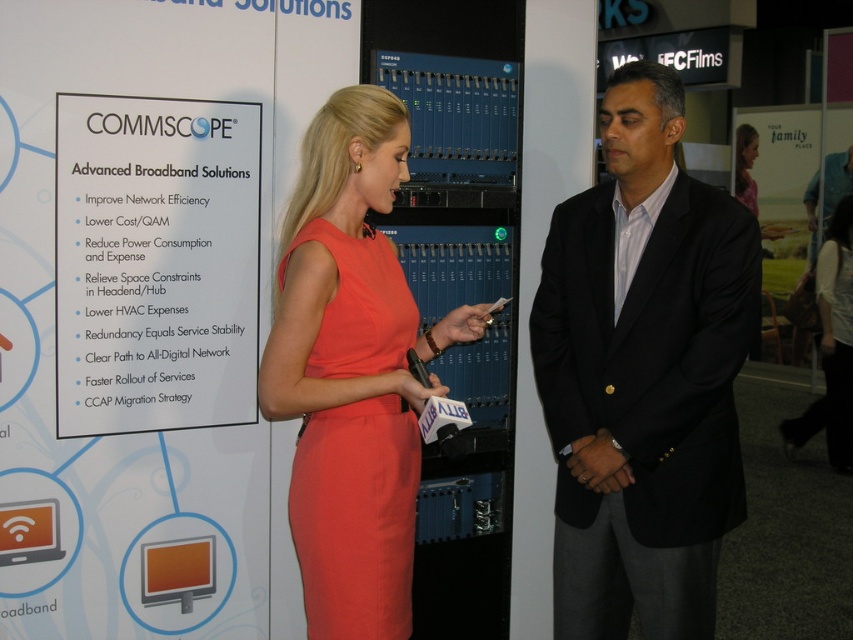
You are standing in the center of the exhibition hall and need to locate the black suit at center. According to the coordinates provided, where should you look relative to the banner?

The black suit at center is located at coordinates point (643, 374), which is to the right and slightly below the center of the banner.

You are a photographer at the trade show and need to take a photo of the black suit at center. Your camera has a minimum focusing distance of 1.5 meters. Can you take a clear photo without moving the camera or the subject?

The black suit at center and camera are 1.88 meters apart. Since the minimum focusing distance is 1.5 meters, the camera can focus and take a clear photo as the distance is sufficient.